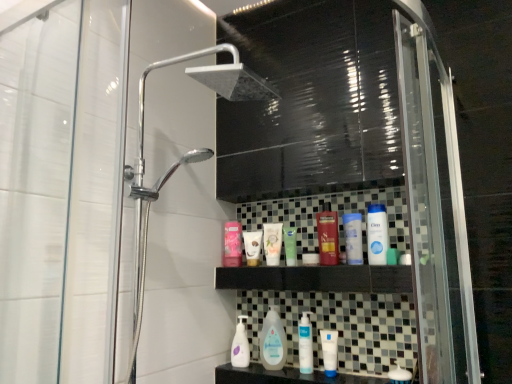
Question: Does point (335, 334) appear closer or farther from the camera than point (232, 266)?

Choices:
 (A) farther
 (B) closer

Answer: (B)

Question: In terms of width, does white matte tube at center, acting as the 2th mouthwash starting from the left, look wider or thinner when compared to pink matte lotion at upper center, marked as the 1th toiletry in a left-to-right arrangement?

Choices:
 (A) wide
 (B) thin

Answer: (B)

Question: Which of these objects is positioned closest to the green matte tube at center, arranged as the 5th toiletry when viewed from the right?

Choices:
 (A) white glossy lotion at center, the 7th toiletry in the left-to-right sequence
 (B) clear plastic baby bottle at center, which is the first cleaning product in right-to-left order
 (C) white matte container at center, the fourth toiletry positioned from the right
 (D) matte white tube at center, which is the 2th toiletry in left-to-right order
 (E) pink matte lotion at upper center, which appears as the 8th toiletry when viewed from the right

Answer: (C)

Question: Based on their relative distances, which object is farther from the white glossy mouthwash at lower center, arranged as the second mouthwash when ordered from the bottom?

Choices:
 (A) green matte tube at center, the 4th toiletry in the left-to-right sequence
 (B) white matte tube at center, acting as the 2th mouthwash starting from the left
 (C) white glossy soap at lower center, which ranks as the 8th toiletry in left-to-right order
 (D) matte white tube at center, which is the 2th toiletry in left-to-right order
 (E) clear plastic baby bottle at center, the second cleaning product in the left-to-right sequence

Answer: (D)